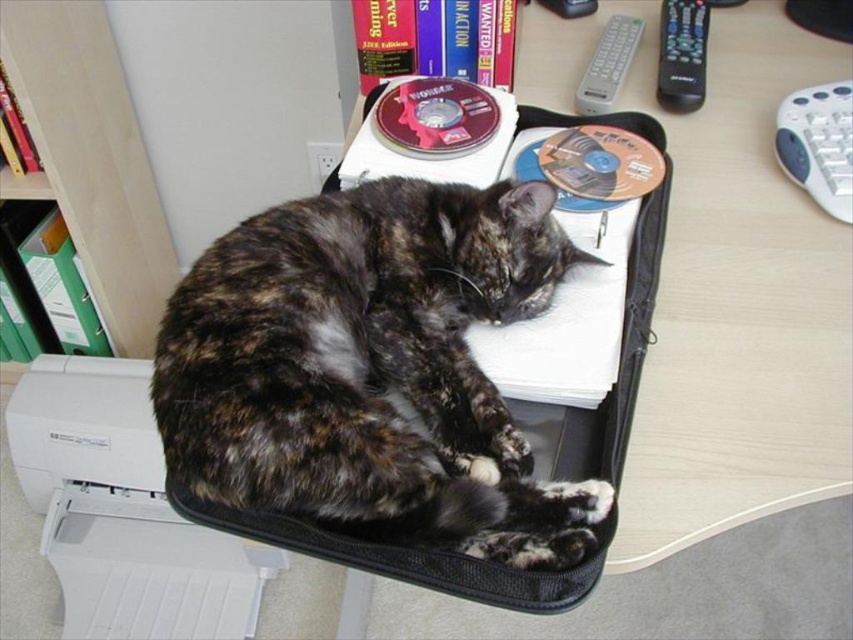
Between tortoiseshell fur cat at center and black plastic remote at upper right, which one is positioned lower?

Positioned lower is tortoiseshell fur cat at center.

Where is `tortoiseshell fur cat at center`? The image size is (853, 640). tortoiseshell fur cat at center is located at coordinates (370, 368).

Does tortoiseshell fur cat at center have a greater width compared to green plastic file at upper left?

Correct, the width of tortoiseshell fur cat at center exceeds that of green plastic file at upper left.

Can you confirm if tortoiseshell fur cat at center is positioned above green plastic file at upper left?

No.

The height and width of the screenshot is (640, 853). What do you see at coordinates (370, 368) in the screenshot?
I see `tortoiseshell fur cat at center` at bounding box center [370, 368].

Identify the location of tortoiseshell fur cat at center. The width and height of the screenshot is (853, 640). (370, 368).

Who is more forward, (495,108) or (679,109)?

Point (495,108) is in front.

What do you see at coordinates (434, 116) in the screenshot?
I see `shiny silver cd at center` at bounding box center [434, 116].

Find the location of a particular element. shiny silver cd at center is located at coordinates (434, 116).